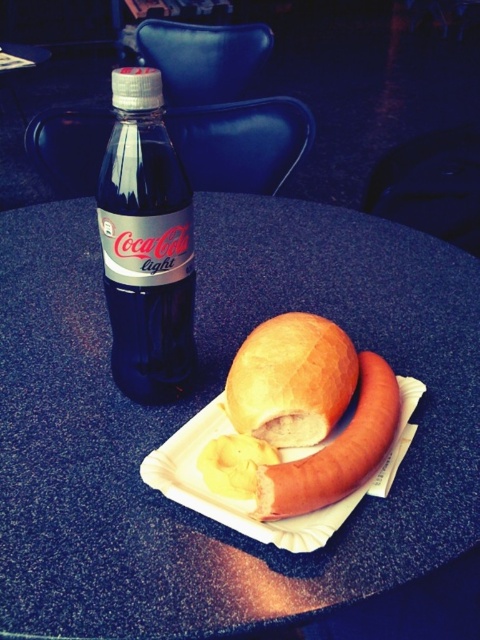
Question: Which point is closer to the camera?

Choices:
 (A) slightly toasted bread at center
 (B) blue glass bottle at left

Answer: (A)

Question: Does white paper plate at center appear over yellowish matte potato at center?

Choices:
 (A) no
 (B) yes

Answer: (B)

Question: Which point is closer to the camera?

Choices:
 (A) (158, 362)
 (B) (288, 456)
 (C) (444, 307)

Answer: (B)

Question: Among these points, which one is nearest to the camera?

Choices:
 (A) (112, 632)
 (B) (201, 451)
 (C) (288, 444)

Answer: (A)

Question: Can you confirm if golden matte roll at center is positioned above yellowish matte potato at center?

Choices:
 (A) no
 (B) yes

Answer: (B)

Question: Is blue speckled table at center wider than yellowish matte potato at center?

Choices:
 (A) yes
 (B) no

Answer: (A)